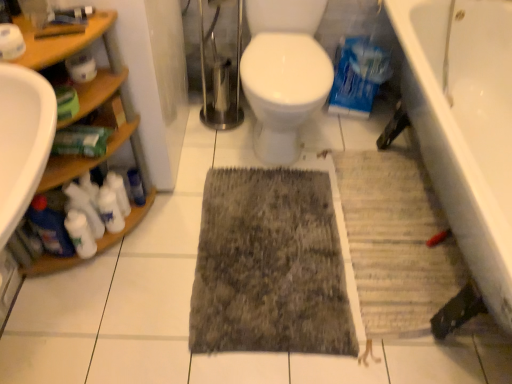
Locate an element on the screen. The width and height of the screenshot is (512, 384). vacant area that is in front of white matte cleaning product at left, placed as the 4th cleaning product when sorted from left to right is located at coordinates (124, 259).